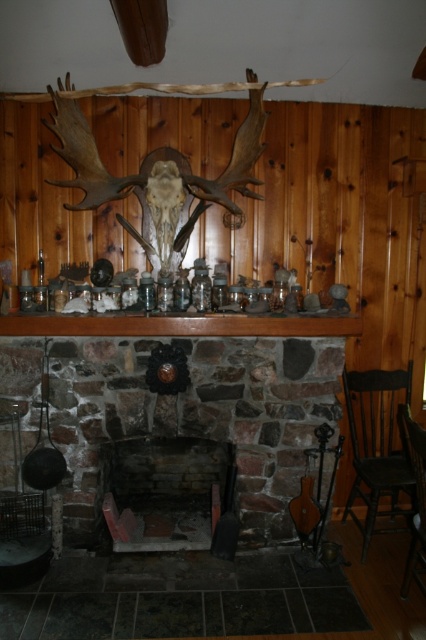
Does brick fireplace at center have a greater height compared to dark brown wooden chair at right?

Incorrect, brick fireplace at center's height is not larger of dark brown wooden chair at right's.

Image resolution: width=426 pixels, height=640 pixels. Identify the location of brick fireplace at center. (169, 493).

Does brick fireplace at center appear on the left side of black wood chair at right?

Correct, you'll find brick fireplace at center to the left of black wood chair at right.

Which is behind, point (164, 522) or point (402, 417)?

Point (164, 522)

Where is `brick fireplace at center`? brick fireplace at center is located at coordinates (169, 493).

Between point (389, 388) and point (422, 515), which one is positioned behind?

The point (389, 388) is behind.

Between dark brown wooden chair at right and black wood chair at right, which one has more height?

dark brown wooden chair at right

Locate an element on the screen. The width and height of the screenshot is (426, 640). dark brown wooden chair at right is located at coordinates (377, 444).

Locate an element on the screen. This screenshot has height=640, width=426. dark brown wooden chair at right is located at coordinates (377, 444).